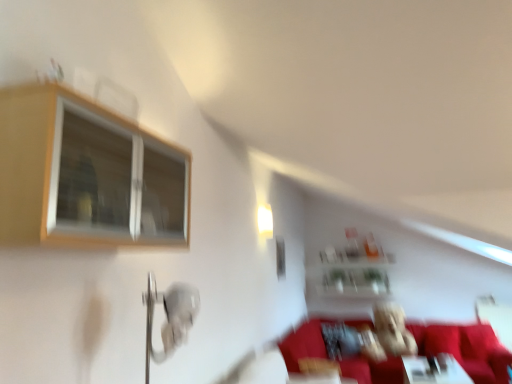
Where is `velvet red couch at lower right`? velvet red couch at lower right is located at coordinates (466, 349).

Locate an element on the screen. The image size is (512, 384). wooden frame window at upper left is located at coordinates (86, 174).

Measure the distance between wooden frame window at upper left and camera.

The depth of wooden frame window at upper left is 3.54 feet.

What are the coordinates of `clear glass shelf at upper center` in the screenshot? It's located at (354, 282).

Describe the element at coordinates (265, 221) in the screenshot. I see `white glossy light fixture at upper center` at that location.

This screenshot has height=384, width=512. In order to click on fuzzy fabric teddy bear at center in this screenshot , I will do `click(393, 330)`.

Image resolution: width=512 pixels, height=384 pixels. What do you see at coordinates (393, 330) in the screenshot?
I see `fuzzy fabric teddy bear at center` at bounding box center [393, 330].

Where is `velvet red couch at lower right`? This screenshot has width=512, height=384. velvet red couch at lower right is located at coordinates (466, 349).

Can you confirm if fuzzy fabric teddy bear at center is positioned to the right of wooden frame window at upper left?

Indeed, fuzzy fabric teddy bear at center is positioned on the right side of wooden frame window at upper left.

How far apart are fuzzy fabric teddy bear at center and wooden frame window at upper left?

fuzzy fabric teddy bear at center and wooden frame window at upper left are 4.57 meters apart from each other.

Is point (415, 352) less distant than point (177, 240)?

That is False.

From a real-world perspective, who is located higher, fuzzy fabric teddy bear at center or wooden frame window at upper left?

wooden frame window at upper left is physically above.

There is a clear glass shelf at upper center. Where is `light fixture above it (from a real-world perspective)`? light fixture above it (from a real-world perspective) is located at coordinates (265, 221).

Is point (258, 220) positioned after point (368, 269)?

No, (258, 220) is closer to viewer.

From the image's perspective, who appears lower, white glossy light fixture at upper center or clear glass shelf at upper center?

clear glass shelf at upper center, from the image's perspective.

Is fuzzy fabric teddy bear at center facing towards white glossy table at lower right?

Yes, fuzzy fabric teddy bear at center is facing white glossy table at lower right.

Which object is wider, fuzzy fabric teddy bear at center or white glossy table at lower right?

white glossy table at lower right is wider.

Considering the sizes of fuzzy fabric teddy bear at center and white glossy table at lower right in the image, is fuzzy fabric teddy bear at center taller or shorter than white glossy table at lower right?

Clearly, fuzzy fabric teddy bear at center is taller compared to white glossy table at lower right.

Is fuzzy fabric teddy bear at center touching white glossy table at lower right?

No, fuzzy fabric teddy bear at center is not in contact with white glossy table at lower right.

Which of these two, velvet red couch at lower right or clear glass shelf at upper center, is bigger?

velvet red couch at lower right.

From the image's perspective, is velvet red couch at lower right located above or below clear glass shelf at upper center?

From the image's perspective, velvet red couch at lower right appears below clear glass shelf at upper center.

Does velvet red couch at lower right have a greater height compared to clear glass shelf at upper center?

Yes.

Can you confirm if clear glass shelf at upper center is thinner than fuzzy fabric teddy bear at center?

Yes.

Does clear glass shelf at upper center appear on the left side of fuzzy fabric teddy bear at center?

Correct, you'll find clear glass shelf at upper center to the left of fuzzy fabric teddy bear at center.

From a real-world perspective, which object stands above the other?

clear glass shelf at upper center, from a real-world perspective.

Does velvet red couch at lower right have a smaller size compared to white glossy light fixture at upper center?

No.

Where is `light fixture that appears above the velvet red couch at lower right (from the image's perspective)`? light fixture that appears above the velvet red couch at lower right (from the image's perspective) is located at coordinates (265, 221).

Considering the positions of objects velvet red couch at lower right and white glossy light fixture at upper center in the image provided, who is more to the left, velvet red couch at lower right or white glossy light fixture at upper center?

From the viewer's perspective, white glossy light fixture at upper center appears more on the left side.

From the image's perspective, is white glossy light fixture at upper center beneath fuzzy fabric teddy bear at center?

No, from the image's perspective, white glossy light fixture at upper center is not below fuzzy fabric teddy bear at center.

The height and width of the screenshot is (384, 512). I want to click on light fixture in front of the fuzzy fabric teddy bear at center, so click(265, 221).

Looking at this image, between white glossy light fixture at upper center and fuzzy fabric teddy bear at center, which one has smaller size?

white glossy light fixture at upper center is smaller.

Locate an element on the screen. The height and width of the screenshot is (384, 512). toy behind the wooden frame window at upper left is located at coordinates (393, 330).

Where is `light fixture above the clear glass shelf at upper center (from a real-world perspective)`? This screenshot has width=512, height=384. light fixture above the clear glass shelf at upper center (from a real-world perspective) is located at coordinates (265, 221).

Looking at the image, which one is located further to fuzzy fabric teddy bear at center, clear glass shelf at upper center or white glossy table at lower right?

clear glass shelf at upper center is further to fuzzy fabric teddy bear at center.

When comparing their distances from clear glass shelf at upper center, does velvet red couch at lower right or white glossy light fixture at upper center seem further?

white glossy light fixture at upper center lies further to clear glass shelf at upper center than the other object.

When comparing their distances from clear glass shelf at upper center, does wooden frame window at upper left or white glossy table at lower right seem closer?

Among the two, white glossy table at lower right is located nearer to clear glass shelf at upper center.

From the image, which object appears to be farther from fuzzy fabric teddy bear at center, velvet red couch at lower right or white glossy table at lower right?

velvet red couch at lower right is positioned further to the anchor fuzzy fabric teddy bear at center.

From the image, which object appears to be nearer to clear glass shelf at upper center, white glossy light fixture at upper center or fuzzy fabric teddy bear at center?

fuzzy fabric teddy bear at center lies closer to clear glass shelf at upper center than the other object.

From the image, which object appears to be nearer to white glossy light fixture at upper center, velvet red couch at lower right or white glossy table at lower right?

The object closer to white glossy light fixture at upper center is white glossy table at lower right.

Estimate the real-world distances between objects in this image. Which object is further from fuzzy fabric teddy bear at center, clear glass shelf at upper center or white glossy light fixture at upper center?

white glossy light fixture at upper center is further to fuzzy fabric teddy bear at center.

When comparing their distances from clear glass shelf at upper center, does wooden frame window at upper left or white glossy light fixture at upper center seem closer?

white glossy light fixture at upper center is closer to clear glass shelf at upper center.

Find the location of a particular element. The image size is (512, 384). toy between white glossy light fixture at upper center and white glossy table at lower right from left to right is located at coordinates click(393, 330).

You are a GUI agent. You are given a task and a screenshot of the screen. Output one action in this format:
    pyautogui.click(x=<x>, y=<y>)
    Task: Click on the couch positioned between wooden frame window at upper left and fuzzy fabric teddy bear at center from near to far
    Image resolution: width=512 pixels, height=384 pixels.
    Given the screenshot: What is the action you would take?
    pyautogui.click(x=466, y=349)

You are a GUI agent. You are given a task and a screenshot of the screen. Output one action in this format:
    pyautogui.click(x=<x>, y=<y>)
    Task: Click on the light fixture between wooden frame window at upper left and fuzzy fabric teddy bear at center from front to back
    The image size is (512, 384).
    Given the screenshot: What is the action you would take?
    pyautogui.click(x=265, y=221)

Where is `couch located between white glossy table at lower right and fuzzy fabric teddy bear at center in the depth direction`? This screenshot has width=512, height=384. couch located between white glossy table at lower right and fuzzy fabric teddy bear at center in the depth direction is located at coordinates (466, 349).